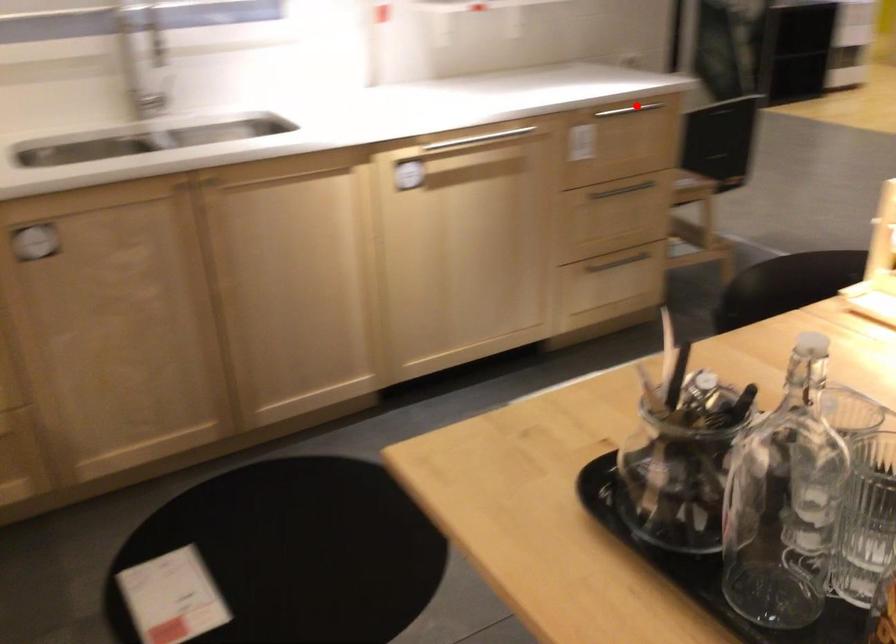
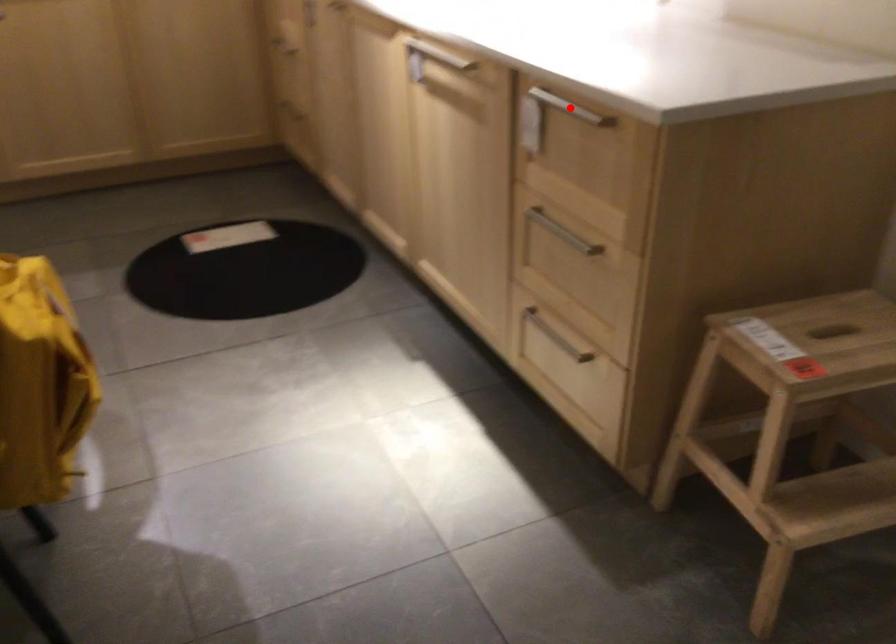
I am providing you with two images of the same scene from different viewpoints. A red point is marked on the first image and another point is marked on the second image. Do the highlighted points in image1 and image2 indicate the same real-world spot?

Yes